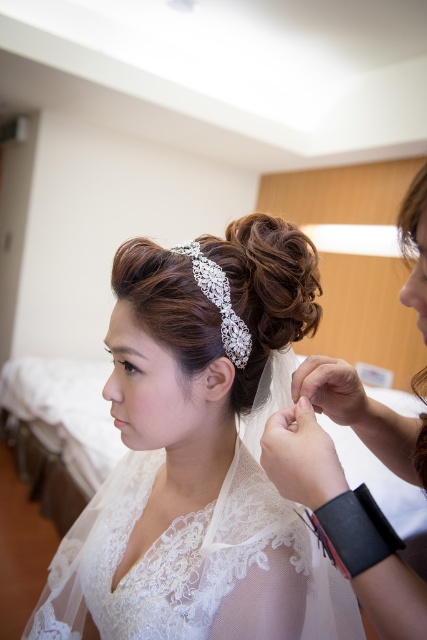
Question: Which object is positioned farthest from the clear crystal headband at center?

Choices:
 (A) lace fabric wedding dress at center
 (B) white lace veil at upper center

Answer: (A)

Question: Can you confirm if white lace veil at upper center is positioned below clear crystal headband at center?

Choices:
 (A) no
 (B) yes

Answer: (B)

Question: Among these points, which one is nearest to the camera?

Choices:
 (A) (28, 624)
 (B) (339, 483)
 (C) (105, 488)
 (D) (186, 316)

Answer: (B)

Question: Is lace fabric wedding dress at center positioned before clear crystal headband at center?

Choices:
 (A) yes
 (B) no

Answer: (A)

Question: Which of the following is the farthest from the observer?

Choices:
 (A) (160, 252)
 (B) (119, 508)
 (C) (245, 618)
 (D) (332, 470)

Answer: (B)

Question: Is white lace veil at upper center further to the viewer compared to lace fabric wedding dress at center?

Choices:
 (A) yes
 (B) no

Answer: (B)